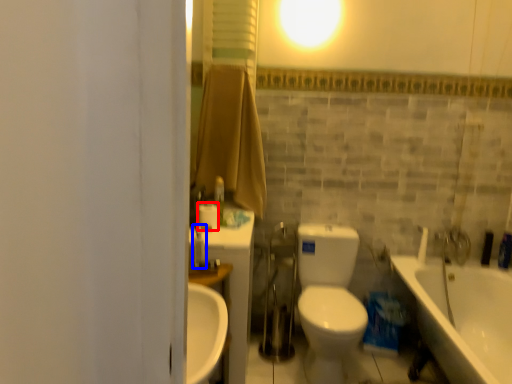
Question: Which object is further to the camera taking this photo, toilet paper (highlighted by a red box) or fixture (highlighted by a blue box)?

Choices:
 (A) toilet paper
 (B) fixture

Answer: (A)